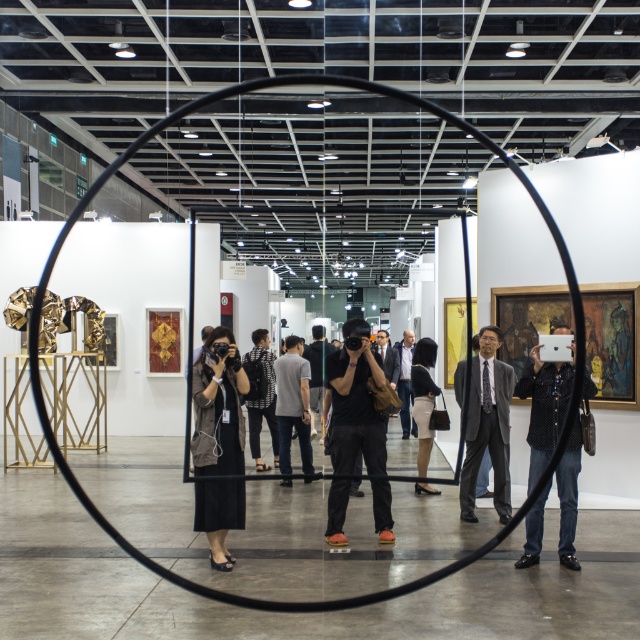
You are an artist trying to place a new sculpture between the black matte dress at center and the black leather skirt at center. Which side should you place it on to ensure it fits within the available space?

The black matte dress at center is wider than the black leather skirt at center. Therefore, placing the sculpture on the side of the black leather skirt at center would provide more space for the sculpture to fit comfortably.

You are standing in the art exhibition space and notice a black circular frame in the foreground. There is a person wearing a black matte dress at center. Can you determine if the point at coordinates (218, 406) is located on the black matte dress at center?

The point at coordinates (218, 406) is on the black matte dress at center.